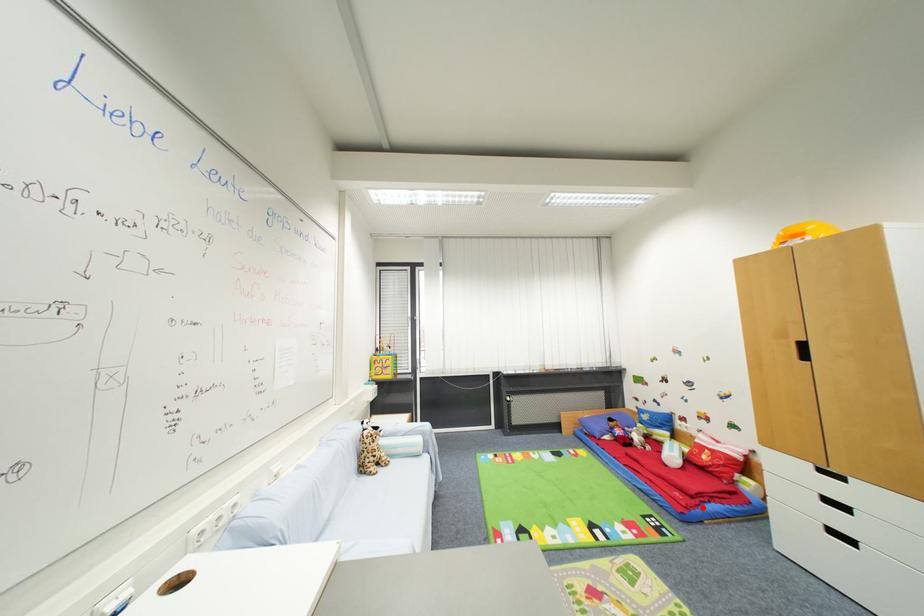
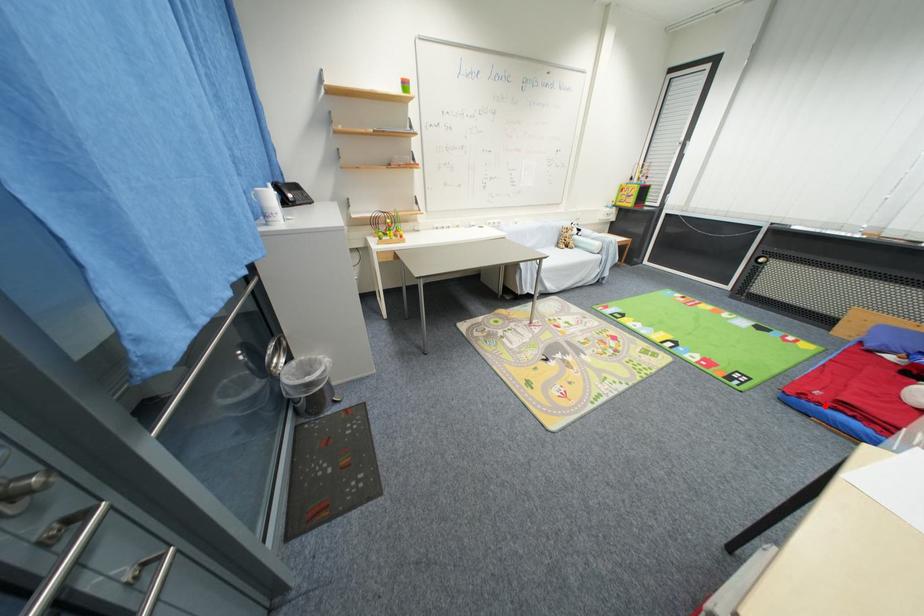
I am providing you with two images of the same scene from different viewpoints. A red point is marked on the first image and another point is marked on the second image. Is the marked point in image1 the same physical position as the marked point in image2?

Yes